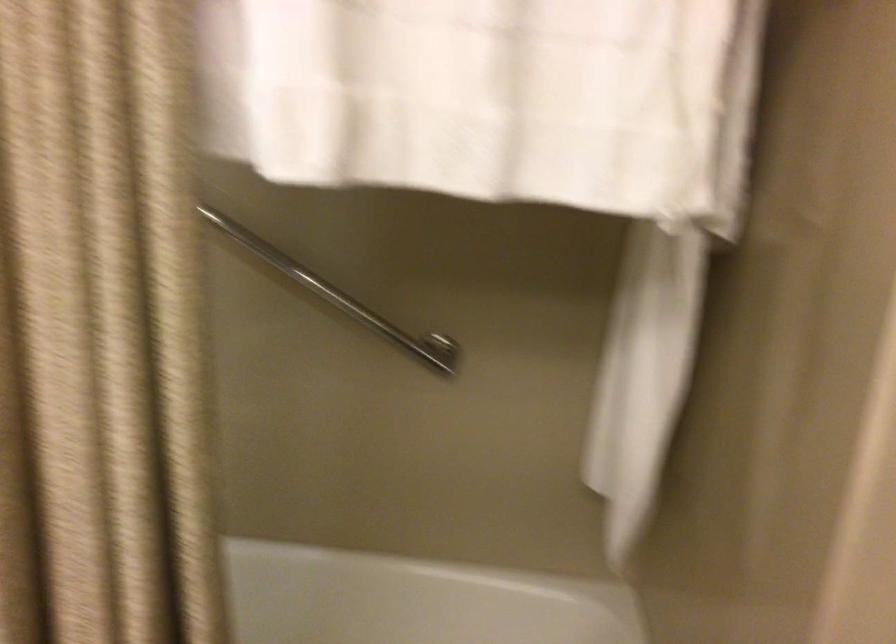
The first image is from the beginning of the video and the second image is from the end. How did the camera likely rotate when shooting the video?

The rotation direction of the camera is right-down.